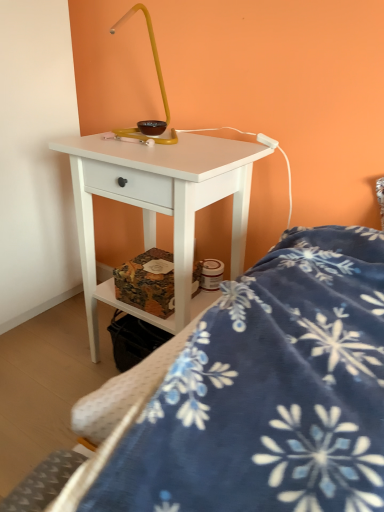
At what (x,y) coordinates should I click in order to perform the action: click on white matte nightstand at center. Please return your answer as a coordinate pair (x, y). The width and height of the screenshot is (384, 512). Looking at the image, I should click on (158, 205).

Describe the element at coordinates (158, 205) in the screenshot. I see `white matte nightstand at center` at that location.

What is the approximate height of white matte nightstand at center?

white matte nightstand at center is 28.01 inches tall.

At what (x,y) coordinates should I click in order to perform the action: click on blue fleece blanket at lower right. Please return your answer as a coordinate pair (x, y). The image size is (384, 512). Looking at the image, I should click on (257, 397).

What do you see at coordinates (257, 397) in the screenshot?
I see `blue fleece blanket at lower right` at bounding box center [257, 397].

Identify the location of white matte nightstand at center. The height and width of the screenshot is (512, 384). (158, 205).

Considering the relative positions of blue fleece blanket at lower right and white matte nightstand at center in the image provided, is blue fleece blanket at lower right to the right of white matte nightstand at center from the viewer's perspective?

Indeed, blue fleece blanket at lower right is positioned on the right side of white matte nightstand at center.

Is blue fleece blanket at lower right in front of or behind white matte nightstand at center in the image?

blue fleece blanket at lower right is in front of white matte nightstand at center.

Does point (132, 469) appear closer or farther from the camera than point (167, 163)?

Point (132, 469).

From the image's perspective, is blue fleece blanket at lower right positioned above or below white matte nightstand at center?

From the image's perspective, blue fleece blanket at lower right appears below white matte nightstand at center.

From a real-world perspective, is blue fleece blanket at lower right positioned under white matte nightstand at center based on gravity?

No, from a real-world perspective, blue fleece blanket at lower right is not under white matte nightstand at center.

Considering the sizes of objects blue fleece blanket at lower right and white matte nightstand at center in the image provided, who is thinner, blue fleece blanket at lower right or white matte nightstand at center?

Thinner between the two is white matte nightstand at center.

Based on the photo, can you confirm if blue fleece blanket at lower right is shorter than white matte nightstand at center?

Yes, blue fleece blanket at lower right is shorter than white matte nightstand at center.

Who is smaller, blue fleece blanket at lower right or white matte nightstand at center?

blue fleece blanket at lower right is smaller.

Is blue fleece blanket at lower right not inside white matte nightstand at center?

Yes, blue fleece blanket at lower right is outside of white matte nightstand at center.

In the scene shown: Are blue fleece blanket at lower right and white matte nightstand at center making contact?

No, blue fleece blanket at lower right is not next to white matte nightstand at center.

Is blue fleece blanket at lower right facing away from white matte nightstand at center?

No.

What's the angular difference between blue fleece blanket at lower right and white matte nightstand at center's facing directions?

They differ by 89 degrees in their facing directions.

Identify the location of nightstand that is on the left side of blue fleece blanket at lower right. The height and width of the screenshot is (512, 384). (158, 205).

Is white matte nightstand at center to the left or to the right of blue fleece blanket at lower right in the image?

From the image, it's evident that white matte nightstand at center is to the left of blue fleece blanket at lower right.

From the picture: Considering their positions, is white matte nightstand at center located in front of or behind blue fleece blanket at lower right?

Visually, white matte nightstand at center is located behind blue fleece blanket at lower right.

Which is farther from the camera, (151,220) or (167,443)?

The point (151,220) is more distant.

From the image's perspective, is white matte nightstand at center beneath blue fleece blanket at lower right?

Actually, white matte nightstand at center appears above blue fleece blanket at lower right in the image.

From a real-world perspective, is white matte nightstand at center over blue fleece blanket at lower right?

No, from a real-world perspective, white matte nightstand at center is not on top of blue fleece blanket at lower right.

In terms of width, does white matte nightstand at center look wider or thinner when compared to blue fleece blanket at lower right?

In the image, white matte nightstand at center appears to be more narrow than blue fleece blanket at lower right.

Between white matte nightstand at center and blue fleece blanket at lower right, which one has more height?

With more height is white matte nightstand at center.

Which of these two, white matte nightstand at center or blue fleece blanket at lower right, is bigger?

white matte nightstand at center is bigger.

Is white matte nightstand at center inside or outside of blue fleece blanket at lower right?

white matte nightstand at center is not inside blue fleece blanket at lower right, it's outside.

Is white matte nightstand at center not near blue fleece blanket at lower right?

They are positioned close to each other.

Is white matte nightstand at center facing away from blue fleece blanket at lower right?

No, white matte nightstand at center's orientation is not away from blue fleece blanket at lower right.

How different are the orientations of white matte nightstand at center and blue fleece blanket at lower right in degrees?

There is a 89-degree angle between the facing directions of white matte nightstand at center and blue fleece blanket at lower right.

The image size is (384, 512). I want to click on bed that is above the white matte nightstand at center (from a real-world perspective), so click(257, 397).

Locate an element on the screen. This screenshot has width=384, height=512. bed below the white matte nightstand at center (from the image's perspective) is located at coordinates (257, 397).

The image size is (384, 512). Find the location of `nightstand that appears on the left of blue fleece blanket at lower right`. nightstand that appears on the left of blue fleece blanket at lower right is located at coordinates (158, 205).